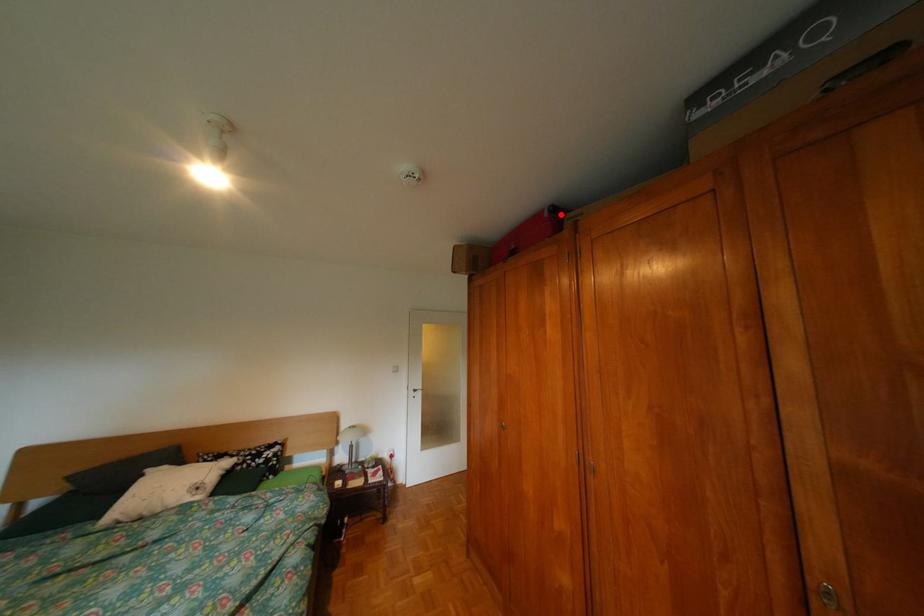
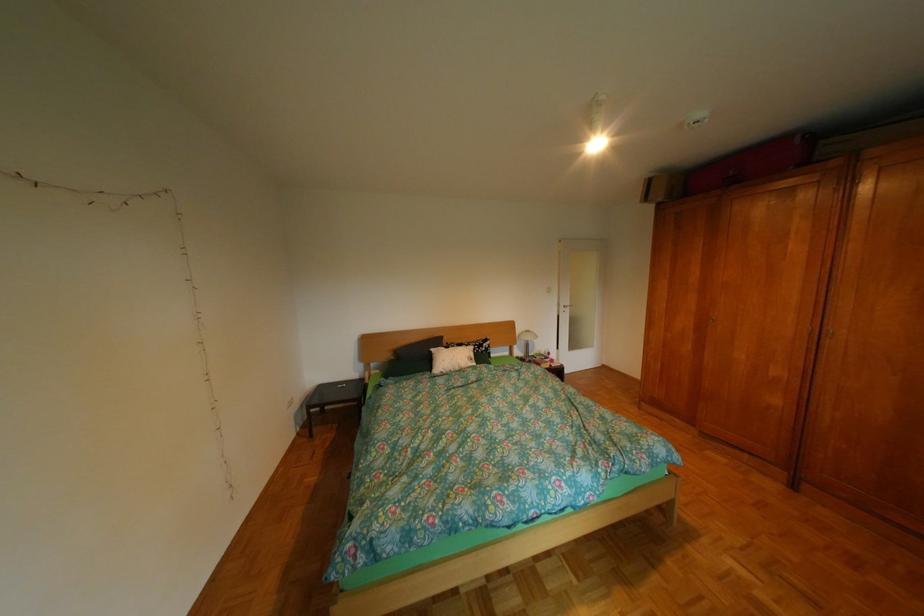
Where in the second image is the point corresponding to the highlighted location from the first image?

(812, 142)